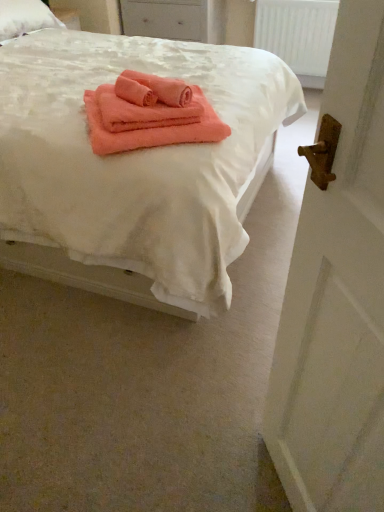
Find the location of a particular element. coral soft towel at center is located at coordinates (149, 114).

The width and height of the screenshot is (384, 512). I want to click on coral soft towel at center, so click(135, 167).

Measure the distance between point (x=178, y=228) and camera.

They are 4.51 feet apart.

What do you see at coordinates (163, 88) in the screenshot? I see `coral soft towel at center` at bounding box center [163, 88].

Describe the element at coordinates (297, 33) in the screenshot. I see `white plastic radiator at upper center` at that location.

Locate an element on the screen. white plastic radiator at upper center is located at coordinates (297, 33).

The height and width of the screenshot is (512, 384). Find the location of `coral soft towel at center`. coral soft towel at center is located at coordinates (149, 114).

Is coral soft towel at center spatially inside coral soft towel at center, or outside of it?

coral soft towel at center is spatially situated outside coral soft towel at center.

From the image's perspective, which is below, coral soft towel at center or coral soft towel at center?

coral soft towel at center appears lower in the image.

Which of these two, coral soft towel at center or coral soft towel at center, is wider?

With larger width is coral soft towel at center.

Locate an element on the screen. bed that appears above the coral soft towel at center (from the image's perspective) is located at coordinates (135, 167).

Is coral soft towel at center smaller than coral soft towel at center?

Yes, coral soft towel at center is smaller than coral soft towel at center.

Choose the correct answer: Is coral soft towel at center inside coral soft towel at center or outside it?

coral soft towel at center lies within the bounds of coral soft towel at center.

From a real-world perspective, between coral soft towel at center and coral soft towel at center, who is vertically lower?

From a 3D spatial view, coral soft towel at center is below.

Is coral soft towel at center at the right side of white plastic radiator at upper center?

In fact, coral soft towel at center is to the left of white plastic radiator at upper center.

Which is less distant, (13, 237) or (323, 18)?

Positioned in front is point (13, 237).

Who is taller, coral soft towel at center or white plastic radiator at upper center?

coral soft towel at center.

How distant is coral soft towel at center from white plastic radiator at upper center?

They are 7.31 feet apart.

Would you say white plastic radiator at upper center is part of coral soft towel at center's contents?

That's incorrect, white plastic radiator at upper center is not inside coral soft towel at center.

Is point (202, 122) positioned in front of point (316, 70)?

Yes, point (202, 122) is closer to viewer.

How far apart are coral soft towel at center and coral soft towel at center?

The distance of coral soft towel at center from coral soft towel at center is 21.97 inches.

Considering the positions of objects coral soft towel at center and coral soft towel at center in the image provided, who is behind, coral soft towel at center or coral soft towel at center?

coral soft towel at center.

Can you confirm if coral soft towel at center is smaller than coral soft towel at center?

Indeed, coral soft towel at center has a smaller size compared to coral soft towel at center.

Can coral soft towel at center be found inside white plastic radiator at upper center?

No, coral soft towel at center is not inside white plastic radiator at upper center.

Is white plastic radiator at upper center in contact with coral soft towel at center?

white plastic radiator at upper center is not next to coral soft towel at center, and they're not touching.

Considering the sizes of objects white plastic radiator at upper center and coral soft towel at center in the image provided, who is bigger, white plastic radiator at upper center or coral soft towel at center?

With larger size is white plastic radiator at upper center.

How distant is white plastic radiator at upper center from coral soft towel at center?

white plastic radiator at upper center and coral soft towel at center are 2.23 meters apart.

Based on the photo, does white matte drawer at upper center touch coral soft towel at center?

No, white matte drawer at upper center is not making contact with coral soft towel at center.

Relative to coral soft towel at center, is white matte drawer at upper center in front or behind?

white matte drawer at upper center is behind coral soft towel at center.

Find the location of a particular element. The width and height of the screenshot is (384, 512). drawer that is on the right side of coral soft towel at center is located at coordinates (165, 19).

Could you tell me if white matte drawer at upper center is turned towards coral soft towel at center?

Yes.

This screenshot has height=512, width=384. In the image, there is a coral soft towel at center. In order to click on bed below it (from a real-world perspective) in this screenshot , I will do `click(135, 167)`.

This screenshot has width=384, height=512. I want to click on towel below the coral soft towel at center (from the image's perspective), so click(149, 114).

From the picture: Based on their spatial positions, is white matte drawer at upper center or white wooden door at right closer to white plastic radiator at upper center?

Based on the image, white matte drawer at upper center appears to be nearer to white plastic radiator at upper center.

When comparing their distances from coral soft towel at center, does coral soft towel at center or coral soft towel at center seem closer?

Among the two, coral soft towel at center is located nearer to coral soft towel at center.

Based on their spatial positions, is white wooden door at right or white plastic radiator at upper center further from coral soft towel at center?

white plastic radiator at upper center is positioned further to the anchor coral soft towel at center.

From the image, which object appears to be nearer to white wooden door at right, coral soft towel at center or white plastic radiator at upper center?

coral soft towel at center lies closer to white wooden door at right than the other object.

From the image, which object appears to be farther from white matte drawer at upper center, white wooden door at right or white plastic radiator at upper center?

white wooden door at right is positioned further to the anchor white matte drawer at upper center.

Estimate the real-world distances between objects in this image. Which object is further from coral soft towel at center, white wooden door at right or white matte drawer at upper center?

white matte drawer at upper center lies further to coral soft towel at center than the other object.

Estimate the real-world distances between objects in this image. Which object is closer to coral soft towel at center, coral soft towel at center or white wooden door at right?

coral soft towel at center lies closer to coral soft towel at center than the other object.

Considering their positions, is coral soft towel at center positioned further to coral soft towel at center than coral soft towel at center?

coral soft towel at center is further to coral soft towel at center.

Where is `cloth located between coral soft towel at center and white plastic radiator at upper center in the depth direction`? cloth located between coral soft towel at center and white plastic radiator at upper center in the depth direction is located at coordinates (163, 88).

The width and height of the screenshot is (384, 512). I want to click on bed between white wooden door at right and white plastic radiator at upper center in the front-back direction, so click(x=135, y=167).

You are a GUI agent. You are given a task and a screenshot of the screen. Output one action in this format:
    pyautogui.click(x=<x>, y=<y>)
    Task: Click on the bed located between white wooden door at right and coral soft towel at center in the depth direction
    
    Given the screenshot: What is the action you would take?
    pos(135,167)

Identify the location of cloth located between coral soft towel at center and white matte drawer at upper center in the depth direction. (163, 88).